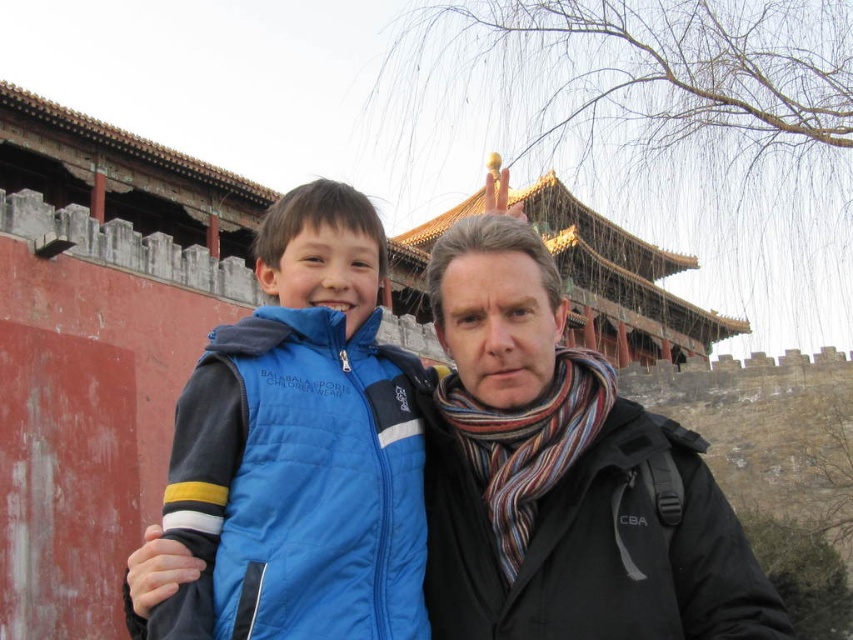
Between point (730, 580) and point (384, 246), which one is positioned in front?

Positioned in front is point (730, 580).

Does matte black jacket at center appear on the left side of blue puffer vest at center?

In fact, matte black jacket at center is to the right of blue puffer vest at center.

Between point (764, 616) and point (254, 547), which one is positioned behind?

The point (254, 547) is more distant.

Locate an element on the screen. matte black jacket at center is located at coordinates (564, 476).